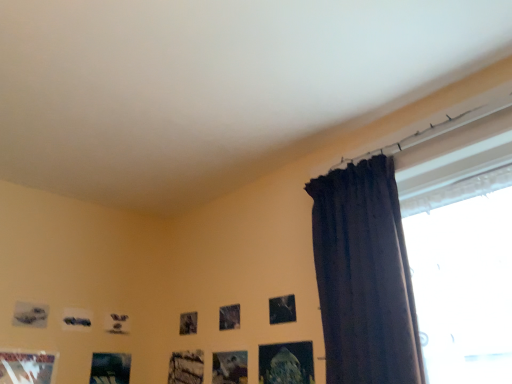
What do you see at coordinates (286, 363) in the screenshot? Image resolution: width=512 pixels, height=384 pixels. I see `metallic glass picture frame at lower center, the 1th picture frame viewed from the right` at bounding box center [286, 363].

Find the location of a particular element. wooden frame at lower center, which is the 4th picture frame from left to right is located at coordinates (186, 367).

Identify the location of dark fabric curtain at right. (364, 276).

This screenshot has width=512, height=384. I want to click on metallic silver picture frame at lower center, the third picture frame in the right-to-left sequence, so click(x=230, y=367).

Locate an element on the screen. This screenshot has width=512, height=384. metallic silver picture frame at lower left, the 6th picture frame in the right-to-left sequence is located at coordinates (26, 367).

This screenshot has height=384, width=512. Find the location of `matte gray picture frame at lower left, arranged as the 7th picture frame when viewed from the right`. matte gray picture frame at lower left, arranged as the 7th picture frame when viewed from the right is located at coordinates (30, 315).

The height and width of the screenshot is (384, 512). I want to click on the 1st picture frame counting from the left side of the metallic silver picture frame at upper center, arranged as the sixth picture frame when viewed from the left, so click(230, 367).

Which is less distant, (x=244, y=365) or (x=286, y=303)?

Point (x=244, y=365) is farther from the camera than point (x=286, y=303).

Considering the positions of objects metallic silver picture frame at lower center, the third picture frame in the right-to-left sequence, and metallic silver picture frame at upper center, which appears as the 2th picture frame when viewed from the right, in the image provided, who is more to the left, metallic silver picture frame at lower center, the third picture frame in the right-to-left sequence, or metallic silver picture frame at upper center, which appears as the 2th picture frame when viewed from the right,?

metallic silver picture frame at lower center, the third picture frame in the right-to-left sequence.

Is matte gray picture frame at lower left, the first picture frame in the left-to-right sequence, aimed at matte black picture frame at lower left, arranged as the 3th picture frame when viewed from the left?

No.

Considering the relative sizes of matte gray picture frame at lower left, arranged as the 7th picture frame when viewed from the right, and matte black picture frame at lower left, arranged as the 3th picture frame when viewed from the left, in the image provided, is matte gray picture frame at lower left, arranged as the 7th picture frame when viewed from the right, smaller than matte black picture frame at lower left, arranged as the 3th picture frame when viewed from the left,?

No.

Is matte gray picture frame at lower left, arranged as the 7th picture frame when viewed from the right, wider or thinner than matte black picture frame at lower left, arranged as the 3th picture frame when viewed from the left?

In the image, matte gray picture frame at lower left, arranged as the 7th picture frame when viewed from the right, appears to be wider than matte black picture frame at lower left, arranged as the 3th picture frame when viewed from the left.

Which object is more forward, matte gray picture frame at lower left, the first picture frame in the left-to-right sequence, or matte black picture frame at lower left, arranged as the 3th picture frame when viewed from the left?

Positioned in front is matte gray picture frame at lower left, the first picture frame in the left-to-right sequence.

Which object is further away from the camera, matte gray picture frame at lower left, arranged as the 7th picture frame when viewed from the right, or wooden frame at lower center, arranged as the fourth picture frame when viewed from the right?

wooden frame at lower center, arranged as the fourth picture frame when viewed from the right, is further from the camera.

How far apart are matte gray picture frame at lower left, arranged as the 7th picture frame when viewed from the right, and wooden frame at lower center, which is the 4th picture frame from left to right?

The distance of matte gray picture frame at lower left, arranged as the 7th picture frame when viewed from the right, from wooden frame at lower center, which is the 4th picture frame from left to right, is 27.59 inches.

From the image's perspective, who appears lower, matte gray picture frame at lower left, arranged as the 7th picture frame when viewed from the right, or wooden frame at lower center, which is the 4th picture frame from left to right?

wooden frame at lower center, which is the 4th picture frame from left to right.

Could you tell me if matte gray picture frame at lower left, the first picture frame in the left-to-right sequence, is turned towards wooden frame at lower center, which is the 4th picture frame from left to right?

No, matte gray picture frame at lower left, the first picture frame in the left-to-right sequence, is not turned towards wooden frame at lower center, which is the 4th picture frame from left to right.

Considering the relative sizes of metallic silver picture frame at lower center, the third picture frame in the right-to-left sequence, and metallic silver picture frame at lower left, the 2th picture frame in the left-to-right sequence, in the image provided, is metallic silver picture frame at lower center, the third picture frame in the right-to-left sequence, shorter than metallic silver picture frame at lower left, the 2th picture frame in the left-to-right sequence,?

Yes, metallic silver picture frame at lower center, the third picture frame in the right-to-left sequence, is shorter than metallic silver picture frame at lower left, the 2th picture frame in the left-to-right sequence.

Considering the relative sizes of metallic silver picture frame at lower center, the 5th picture frame when ordered from left to right, and metallic silver picture frame at lower left, the 2th picture frame in the left-to-right sequence, in the image provided, is metallic silver picture frame at lower center, the 5th picture frame when ordered from left to right, bigger than metallic silver picture frame at lower left, the 2th picture frame in the left-to-right sequence,?

Incorrect, metallic silver picture frame at lower center, the 5th picture frame when ordered from left to right, is not larger than metallic silver picture frame at lower left, the 2th picture frame in the left-to-right sequence.

Where is `curtain lying on the right of metallic silver picture frame at lower left, the 6th picture frame in the right-to-left sequence`? This screenshot has width=512, height=384. curtain lying on the right of metallic silver picture frame at lower left, the 6th picture frame in the right-to-left sequence is located at coordinates (364, 276).

Is metallic silver picture frame at lower left, the 2th picture frame in the left-to-right sequence, facing away from dark fabric curtain at right?

No, metallic silver picture frame at lower left, the 2th picture frame in the left-to-right sequence, is not facing the opposite direction of dark fabric curtain at right.

Between metallic silver picture frame at lower left, the 6th picture frame in the right-to-left sequence, and dark fabric curtain at right, which one has smaller width?

Thinner between the two is metallic silver picture frame at lower left, the 6th picture frame in the right-to-left sequence.

Is metallic silver picture frame at upper center, arranged as the sixth picture frame when viewed from the left, facing away from dark fabric curtain at right?

No, metallic silver picture frame at upper center, arranged as the sixth picture frame when viewed from the left, is not facing the opposite direction of dark fabric curtain at right.

From a real-world perspective, is metallic silver picture frame at upper center, arranged as the sixth picture frame when viewed from the left, located higher than dark fabric curtain at right?

Incorrect, from a real-world perspective, metallic silver picture frame at upper center, arranged as the sixth picture frame when viewed from the left, is lower than dark fabric curtain at right.

Considering the sizes of metallic silver picture frame at upper center, arranged as the sixth picture frame when viewed from the left, and dark fabric curtain at right in the image, is metallic silver picture frame at upper center, arranged as the sixth picture frame when viewed from the left, taller or shorter than dark fabric curtain at right?

Considering their sizes, metallic silver picture frame at upper center, arranged as the sixth picture frame when viewed from the left, has less height than dark fabric curtain at right.

Is metallic silver picture frame at upper center, which appears as the 2th picture frame when viewed from the right, in front of or behind dark fabric curtain at right in the image?

In the image, metallic silver picture frame at upper center, which appears as the 2th picture frame when viewed from the right, appears behind dark fabric curtain at right.

Between metallic silver picture frame at upper center, which appears as the 2th picture frame when viewed from the right, and metallic silver picture frame at lower left, the 2th picture frame in the left-to-right sequence, which one is positioned behind?

metallic silver picture frame at upper center, which appears as the 2th picture frame when viewed from the right, is behind.

From the image's perspective, between metallic silver picture frame at upper center, which appears as the 2th picture frame when viewed from the right, and metallic silver picture frame at lower left, the 6th picture frame in the right-to-left sequence, who is located below?

metallic silver picture frame at lower left, the 6th picture frame in the right-to-left sequence, appears lower in the image.

From a real-world perspective, is metallic silver picture frame at upper center, which appears as the 2th picture frame when viewed from the right, under metallic silver picture frame at lower left, the 2th picture frame in the left-to-right sequence?

No, from a real-world perspective, metallic silver picture frame at upper center, which appears as the 2th picture frame when viewed from the right, is not beneath metallic silver picture frame at lower left, the 2th picture frame in the left-to-right sequence.

In the scene shown: Is metallic silver picture frame at upper center, which appears as the 2th picture frame when viewed from the right, bigger than metallic silver picture frame at lower left, the 6th picture frame in the right-to-left sequence?

No.

This screenshot has height=384, width=512. I want to click on picture frame that is the 5th one when counting upward from the metallic silver picture frame at lower center, the third picture frame in the right-to-left sequence (from the image's perspective), so click(282, 309).

Where is `the 2nd picture frame counting from the left of the matte black picture frame at lower left, which is the fifth picture frame from right to left`? the 2nd picture frame counting from the left of the matte black picture frame at lower left, which is the fifth picture frame from right to left is located at coordinates (x=30, y=315).

Looking at the image, which one is located closer to metallic silver picture frame at lower center, the third picture frame in the right-to-left sequence, matte gray picture frame at lower left, arranged as the 7th picture frame when viewed from the right, or matte black picture frame at lower left, arranged as the 3th picture frame when viewed from the left?

matte black picture frame at lower left, arranged as the 3th picture frame when viewed from the left, is positioned closer to the anchor metallic silver picture frame at lower center, the third picture frame in the right-to-left sequence.

From the image, which object appears to be farther from matte gray picture frame at lower left, the first picture frame in the left-to-right sequence, wooden frame at lower center, which is the 4th picture frame from left to right, or matte black picture frame at lower left, arranged as the 3th picture frame when viewed from the left?

Based on the image, wooden frame at lower center, which is the 4th picture frame from left to right, appears to be further to matte gray picture frame at lower left, the first picture frame in the left-to-right sequence.

From the image, which object appears to be farther from matte black picture frame at lower left, arranged as the 3th picture frame when viewed from the left, matte gray picture frame at lower left, the first picture frame in the left-to-right sequence, or dark fabric curtain at right?

dark fabric curtain at right is further to matte black picture frame at lower left, arranged as the 3th picture frame when viewed from the left.

Considering their positions, is metallic glass picture frame at lower center, the 1th picture frame viewed from the right, positioned further to dark fabric curtain at right than metallic silver picture frame at upper center, which appears as the 2th picture frame when viewed from the right?

metallic silver picture frame at upper center, which appears as the 2th picture frame when viewed from the right.

Consider the image. Estimate the real-world distances between objects in this image. Which object is further from matte black picture frame at lower left, which is the fifth picture frame from right to left, metallic silver picture frame at lower left, the 2th picture frame in the left-to-right sequence, or metallic silver picture frame at upper center, which appears as the 2th picture frame when viewed from the right?

metallic silver picture frame at upper center, which appears as the 2th picture frame when viewed from the right, lies further to matte black picture frame at lower left, which is the fifth picture frame from right to left, than the other object.

Looking at the image, which one is located closer to metallic silver picture frame at lower center, the third picture frame in the right-to-left sequence, matte black picture frame at lower left, arranged as the 3th picture frame when viewed from the left, or metallic silver picture frame at upper center, arranged as the sixth picture frame when viewed from the left?

metallic silver picture frame at upper center, arranged as the sixth picture frame when viewed from the left, is positioned closer to the anchor metallic silver picture frame at lower center, the third picture frame in the right-to-left sequence.

Estimate the real-world distances between objects in this image. Which object is further from dark fabric curtain at right, matte gray picture frame at lower left, the first picture frame in the left-to-right sequence, or wooden frame at lower center, arranged as the fourth picture frame when viewed from the right?

matte gray picture frame at lower left, the first picture frame in the left-to-right sequence, is positioned further to the anchor dark fabric curtain at right.

Estimate the real-world distances between objects in this image. Which object is further from matte gray picture frame at lower left, arranged as the 7th picture frame when viewed from the right, dark fabric curtain at right or metallic silver picture frame at lower left, the 2th picture frame in the left-to-right sequence?

dark fabric curtain at right lies further to matte gray picture frame at lower left, arranged as the 7th picture frame when viewed from the right, than the other object.

Where is `picture frame situated between metallic silver picture frame at lower left, the 6th picture frame in the right-to-left sequence, and wooden frame at lower center, arranged as the fourth picture frame when viewed from the right, from left to right`? This screenshot has height=384, width=512. picture frame situated between metallic silver picture frame at lower left, the 6th picture frame in the right-to-left sequence, and wooden frame at lower center, arranged as the fourth picture frame when viewed from the right, from left to right is located at coordinates (76, 319).

Where is `picture frame between matte black picture frame at lower left, arranged as the 3th picture frame when viewed from the left, and metallic silver picture frame at lower center, the 5th picture frame when ordered from left to right, from left to right`? The image size is (512, 384). picture frame between matte black picture frame at lower left, arranged as the 3th picture frame when viewed from the left, and metallic silver picture frame at lower center, the 5th picture frame when ordered from left to right, from left to right is located at coordinates pyautogui.click(x=186, y=367).